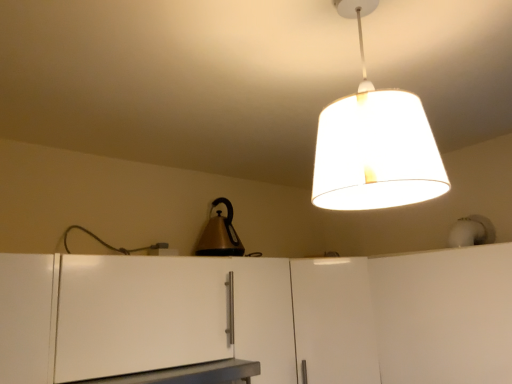
The width and height of the screenshot is (512, 384). Describe the element at coordinates (139, 314) in the screenshot. I see `white matte cabinet at lower left, the third cabinetry viewed from the right` at that location.

Where is `white matte cabinet at center, the 2th cabinetry positioned from the right`? white matte cabinet at center, the 2th cabinetry positioned from the right is located at coordinates (333, 321).

The width and height of the screenshot is (512, 384). I want to click on metallic gold kettle at center, so click(x=220, y=234).

Which of these two, white matte cabinet at lower right, acting as the 1th cabinetry starting from the right, or white matte cabinet at center, the 2th cabinetry positioned from the right, is bigger?

With larger size is white matte cabinet at lower right, acting as the 1th cabinetry starting from the right.

This screenshot has height=384, width=512. Identify the location of cabinetry located below the white matte cabinet at lower right, the third cabinetry viewed from the left (from the image's perspective). (333, 321).

How far apart are white matte cabinet at lower right, the third cabinetry viewed from the left, and white matte cabinet at center, placed as the second cabinetry when sorted from left to right?

white matte cabinet at lower right, the third cabinetry viewed from the left, and white matte cabinet at center, placed as the second cabinetry when sorted from left to right, are 21.39 centimeters apart.

Is white matte cabinet at lower right, the third cabinetry viewed from the left, completely or partially outside of white matte cabinet at center, placed as the second cabinetry when sorted from left to right?

Indeed, white matte cabinet at lower right, the third cabinetry viewed from the left, is completely outside white matte cabinet at center, placed as the second cabinetry when sorted from left to right.

Does white matte cabinet at lower left, the third cabinetry viewed from the right, have a lesser width compared to white fabric lampshade at upper center?

No.

Is white matte cabinet at lower left, the third cabinetry viewed from the right, closer to camera compared to white fabric lampshade at upper center?

No, white matte cabinet at lower left, the third cabinetry viewed from the right, is further to the viewer.

Is white matte cabinet at lower left, the third cabinetry viewed from the right, looking in the opposite direction of white fabric lampshade at upper center?

No, white matte cabinet at lower left, the third cabinetry viewed from the right,'s orientation is not away from white fabric lampshade at upper center.

Consider the image. How distant is metallic gray table at lower center from metallic gold kettle at center?

metallic gray table at lower center and metallic gold kettle at center are 21.27 inches apart.

From the image's perspective, which object appears higher, metallic gray table at lower center or metallic gold kettle at center?

metallic gold kettle at center.

From the picture: Is metallic gray table at lower center not inside metallic gold kettle at center?

Indeed, metallic gray table at lower center is completely outside metallic gold kettle at center.

In terms of width, does metallic gray table at lower center look wider or thinner when compared to metallic gold kettle at center?

Clearly, metallic gray table at lower center has more width compared to metallic gold kettle at center.

Is white matte cabinet at center, placed as the second cabinetry when sorted from left to right, behind metallic gold kettle at center?

No, white matte cabinet at center, placed as the second cabinetry when sorted from left to right, is closer to the viewer.

Between white matte cabinet at center, the 2th cabinetry positioned from the right, and metallic gold kettle at center, which one appears on the right side from the viewer's perspective?

Positioned to the right is white matte cabinet at center, the 2th cabinetry positioned from the right.

What's the angular difference between white matte cabinet at center, placed as the second cabinetry when sorted from left to right, and metallic gold kettle at center's facing directions?

48.8 degrees.

In the scene shown: Considering the relative sizes of white matte cabinet at center, the 2th cabinetry positioned from the right, and metallic gold kettle at center in the image provided, is white matte cabinet at center, the 2th cabinetry positioned from the right, smaller than metallic gold kettle at center?

No.

This screenshot has height=384, width=512. I want to click on the 2nd cabinetry above the metallic gray table at lower center (from the image's perspective), so [139, 314].

From their relative heights in the image, would you say white matte cabinet at lower left, arranged as the first cabinetry when viewed from the left, is taller or shorter than metallic gray table at lower center?

Clearly, white matte cabinet at lower left, arranged as the first cabinetry when viewed from the left, is taller compared to metallic gray table at lower center.

Is point (199, 345) positioned after point (195, 370)?

Yes, it is.

Is white matte cabinet at lower left, arranged as the first cabinetry when viewed from the left, wider than metallic gray table at lower center?

No.

Locate an element on the screen. appliance above the metallic gray table at lower center (from the image's perspective) is located at coordinates (220, 234).

What's the angular difference between metallic gold kettle at center and metallic gray table at lower center's facing directions?

2.99 degrees separate the facing orientations of metallic gold kettle at center and metallic gray table at lower center.

Which is more to the right, metallic gold kettle at center or metallic gray table at lower center?

Positioned to the right is metallic gold kettle at center.

Would you consider metallic gold kettle at center to be distant from metallic gray table at lower center?

No, metallic gold kettle at center is in close proximity to metallic gray table at lower center.

Which of these two, white fabric lampshade at upper center or white matte cabinet at center, placed as the second cabinetry when sorted from left to right, is bigger?

Bigger between the two is white matte cabinet at center, placed as the second cabinetry when sorted from left to right.

Does white fabric lampshade at upper center have a greater width compared to white matte cabinet at center, the 2th cabinetry positioned from the right?

Answer: No.

This screenshot has height=384, width=512. Find the location of `lamp above the white matte cabinet at center, placed as the second cabinetry when sorted from left to right (from the image's perspective)`. lamp above the white matte cabinet at center, placed as the second cabinetry when sorted from left to right (from the image's perspective) is located at coordinates (375, 144).

Based on the photo, is white fabric lampshade at upper center positioned far away from white matte cabinet at center, placed as the second cabinetry when sorted from left to right?

Actually, white fabric lampshade at upper center and white matte cabinet at center, placed as the second cabinetry when sorted from left to right, are a little close together.

Locate an element on the screen. This screenshot has height=384, width=512. cabinetry that is the 1st object located above the white matte cabinet at center, placed as the second cabinetry when sorted from left to right (from the image's perspective) is located at coordinates (444, 315).

The image size is (512, 384). I want to click on lamp above the white matte cabinet at lower left, arranged as the first cabinetry when viewed from the left (from a real-world perspective), so click(375, 144).

Looking at the image, which one is located further to metallic gold kettle at center, metallic gray table at lower center or white fabric lampshade at upper center?

white fabric lampshade at upper center lies further to metallic gold kettle at center than the other object.

Which object lies further to the anchor point white matte cabinet at lower right, the third cabinetry viewed from the left, white matte cabinet at lower left, the third cabinetry viewed from the right, or white fabric lampshade at upper center?

white matte cabinet at lower left, the third cabinetry viewed from the right.

When comparing their distances from white matte cabinet at lower right, acting as the 1th cabinetry starting from the right, does white fabric lampshade at upper center or white matte cabinet at lower left, the third cabinetry viewed from the right, seem closer?

white fabric lampshade at upper center is positioned closer to the anchor white matte cabinet at lower right, acting as the 1th cabinetry starting from the right.

Which object lies further to the anchor point metallic gray table at lower center, white matte cabinet at lower right, the third cabinetry viewed from the left, or metallic gold kettle at center?

Among the two, white matte cabinet at lower right, the third cabinetry viewed from the left, is located further to metallic gray table at lower center.

Based on their spatial positions, is white matte cabinet at lower right, acting as the 1th cabinetry starting from the right, or metallic gray table at lower center closer to white matte cabinet at center, the 2th cabinetry positioned from the right?

white matte cabinet at lower right, acting as the 1th cabinetry starting from the right, is positioned closer to the anchor white matte cabinet at center, the 2th cabinetry positioned from the right.

Consider the image. Considering their positions, is metallic gray table at lower center positioned closer to white matte cabinet at center, placed as the second cabinetry when sorted from left to right, than white fabric lampshade at upper center?

metallic gray table at lower center is positioned closer to the anchor white matte cabinet at center, placed as the second cabinetry when sorted from left to right.

Which object lies nearer to the anchor point white matte cabinet at lower left, arranged as the first cabinetry when viewed from the left, white matte cabinet at lower right, acting as the 1th cabinetry starting from the right, or metallic gold kettle at center?

metallic gold kettle at center lies closer to white matte cabinet at lower left, arranged as the first cabinetry when viewed from the left, than the other object.

Looking at the image, which one is located closer to white fabric lampshade at upper center, white matte cabinet at center, placed as the second cabinetry when sorted from left to right, or metallic gold kettle at center?

The object closer to white fabric lampshade at upper center is white matte cabinet at center, placed as the second cabinetry when sorted from left to right.

Identify the location of table between white matte cabinet at lower left, arranged as the first cabinetry when viewed from the left, and white matte cabinet at center, placed as the second cabinetry when sorted from left to right, in the horizontal direction. (191, 374).

I want to click on appliance situated between white matte cabinet at lower left, arranged as the first cabinetry when viewed from the left, and white matte cabinet at lower right, the third cabinetry viewed from the left, from left to right, so click(220, 234).

Where is `lamp located between metallic gray table at lower center and white matte cabinet at lower right, the third cabinetry viewed from the left, in the left-right direction`? This screenshot has height=384, width=512. lamp located between metallic gray table at lower center and white matte cabinet at lower right, the third cabinetry viewed from the left, in the left-right direction is located at coordinates pyautogui.click(x=375, y=144).

I want to click on table between white fabric lampshade at upper center and white matte cabinet at center, the 2th cabinetry positioned from the right, along the z-axis, so click(191, 374).